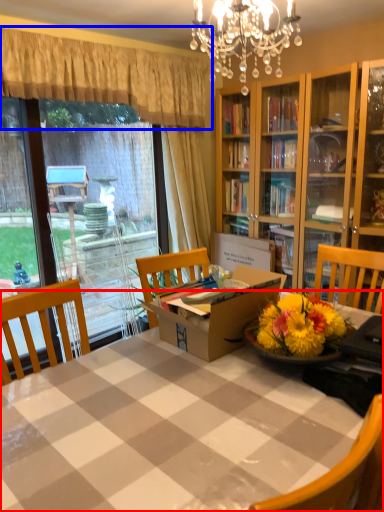
Question: Which point is closer to the camera, table (highlighted by a red box) or curtain (highlighted by a blue box)?

Choices:
 (A) table
 (B) curtain

Answer: (A)